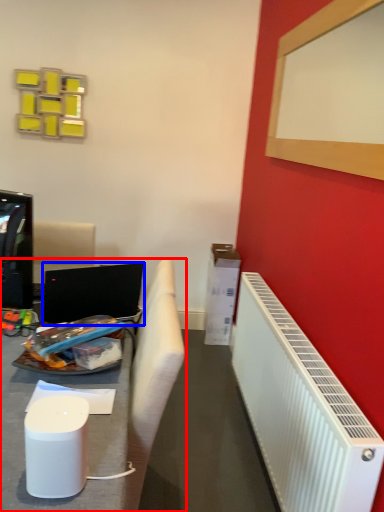
Question: Which of the following is the farthest to the observer, furniture (highlighted by a red box) or laptop (highlighted by a blue box)?

Choices:
 (A) furniture
 (B) laptop

Answer: (B)